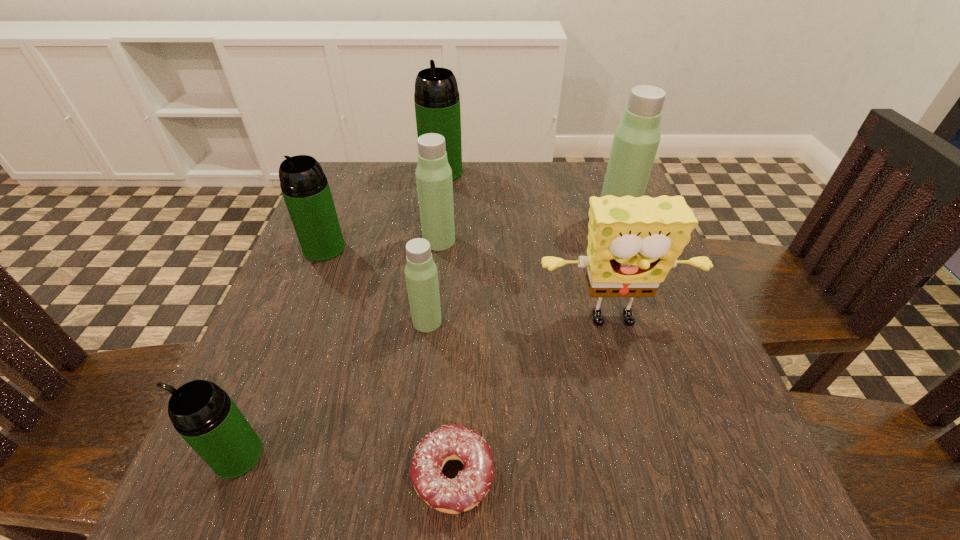
The height and width of the screenshot is (540, 960). In order to click on free space that satisfies the following two spatial constraints: 1. from the spout of the second farthest green thermos bottle; 2. from the spout of the nearest thermos bottle in this screenshot , I will do `click(243, 455)`.

This screenshot has height=540, width=960. Find the location of `vacant point that satisfies the following two spatial constraints: 1. from the spout of the second nearest green thermos bottle; 2. on the left side of the shortest object`. vacant point that satisfies the following two spatial constraints: 1. from the spout of the second nearest green thermos bottle; 2. on the left side of the shortest object is located at coordinates (235, 475).

Locate an element on the screen. This screenshot has height=540, width=960. vacant point that satisfies the following two spatial constraints: 1. on the back side of the biggest light thermos bottle; 2. on the left side of the nearest light thermos bottle is located at coordinates (439, 221).